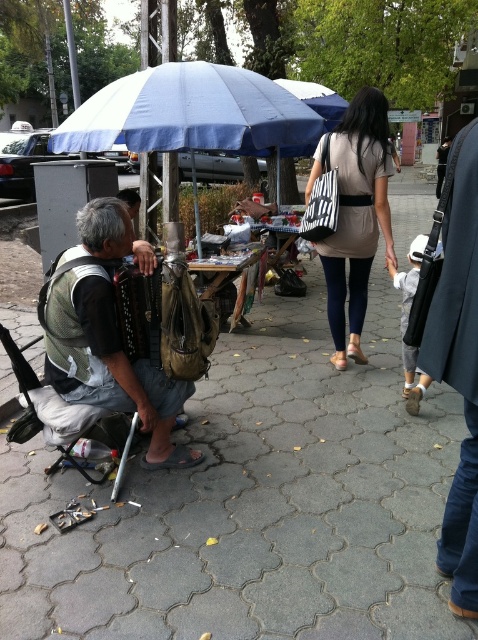
Question: Which point is farther to the camera?

Choices:
 (A) (170, 451)
 (B) (442, 333)

Answer: (A)

Question: Which object is farther from the camera taking this photo?

Choices:
 (A) leather brown bag at left
 (B) blue fabric umbrella at upper center
 (C) beige fabric bag at center

Answer: (B)

Question: Is gray cobblestone pavement at center smaller than blue fabric umbrella at upper center?

Choices:
 (A) no
 (B) yes

Answer: (A)

Question: Is leather brown bag at left above dark gray coat at right?

Choices:
 (A) no
 (B) yes

Answer: (A)

Question: Can you confirm if gray cobblestone pavement at center is wider than leather brown bag at left?

Choices:
 (A) no
 (B) yes

Answer: (A)

Question: Among these points, which one is farthest from the camera?

Choices:
 (A) (8, 499)
 (B) (105, 385)
 (C) (371, 198)

Answer: (C)